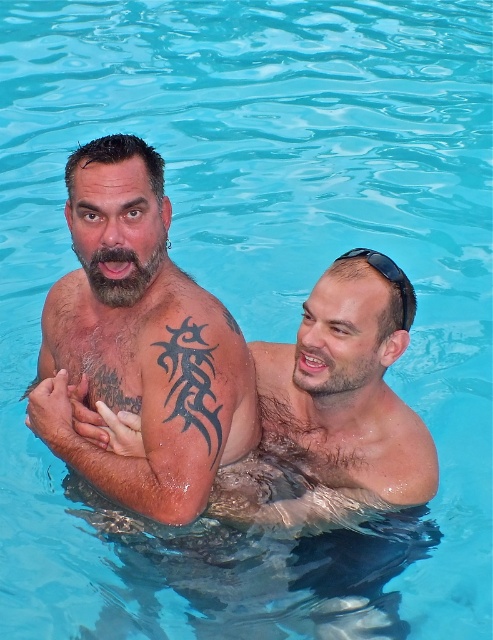
You are standing at the edge of the pool and want to throw a ball to one of the two points in the pool. The first point is at coordinate point (81,156) and the second is at point (378,253). Which point would require you to throw the ball with less force to reach it?

Point (81,156) is closer to the viewer than point (378,253), so you would need to throw the ball with less force to reach point (81,156).

You are a lifeguard trying to ensure safety in the pool. You notice the dark brown skin tattoo at center and the black rubber goggles at upper right. How far apart are these two items in the water?

The dark brown skin tattoo at center and the black rubber goggles at upper right are 1.33 meters apart from each other.